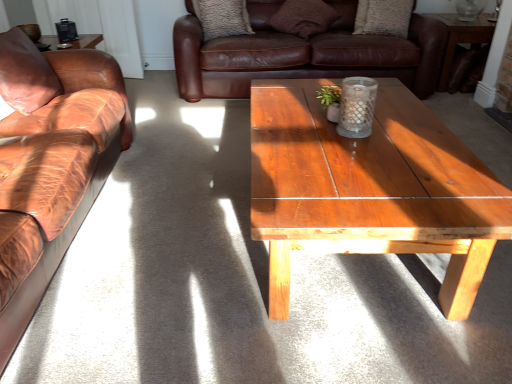
Question: Is textured brown pillow at upper center, positioned as the 3th pillow in front-to-back order, inside the boundaries of wooden table at upper right, or outside?

Choices:
 (A) inside
 (B) outside

Answer: (B)

Question: In the image, is textured brown pillow at upper center, the second pillow when ordered from back to front, on the left side or the right side of wooden table at upper right?

Choices:
 (A) left
 (B) right

Answer: (A)

Question: Which object is positioned farthest from the transparent glass vase at upper right?

Choices:
 (A) textured brown pillow at upper center, positioned as the 3th pillow in front-to-back order
 (B) leather pillow at left, acting as the 1th pillow starting from the left
 (C) brown leather couch at left, which is the 1th studio couch in bottom-to-top order
 (D) textured beige pillow at upper center, the first pillow viewed from the right
 (E) wooden table at upper right

Answer: (B)

Question: Estimate the real-world distances between objects in this image. Which object is closer to the textured brown pillow at upper center, which ranks as the 2th pillow in left-to-right order?

Choices:
 (A) brown leather couch at left, which ranks as the second studio couch in back-to-front order
 (B) brown leather couch at center, acting as the first studio couch starting from the right
 (C) transparent glass vase at upper right
 (D) brown suede pillow at upper center, which is the 3th pillow in left-to-right order
 (E) wooden table at upper right

Answer: (D)